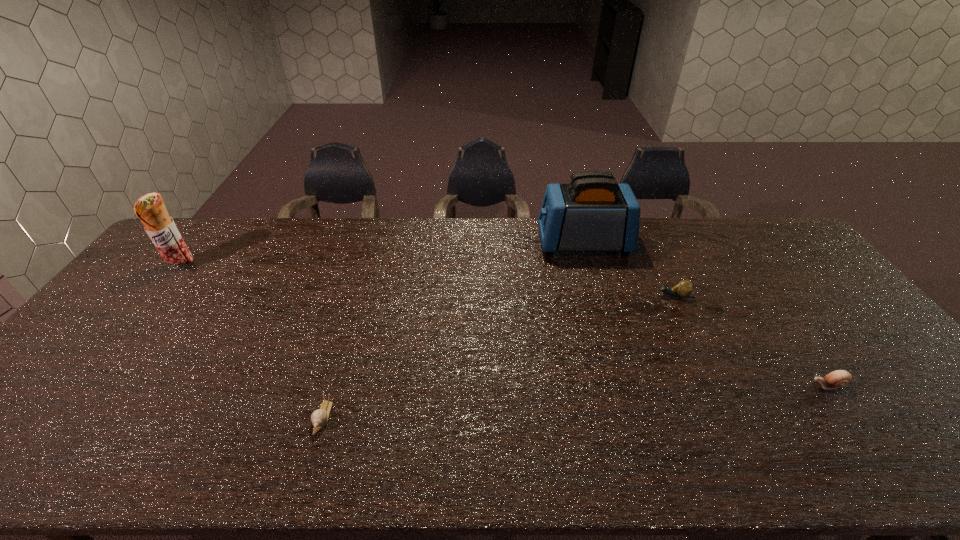
The width and height of the screenshot is (960, 540). What are the coordinates of `the third object from right to left` in the screenshot? It's located at (593, 213).

This screenshot has height=540, width=960. I want to click on the leftmost object, so click(x=150, y=209).

Identify the location of the farthest escargot. The width and height of the screenshot is (960, 540). (684, 288).

Identify the location of the fourth object from left to right. (684, 288).

You are a GUI agent. You are given a task and a screenshot of the screen. Output one action in this format:
    pyautogui.click(x=<x>, y=<y>)
    Task: Click on the fourth farthest object
    This screenshot has height=540, width=960.
    Given the screenshot: What is the action you would take?
    pyautogui.click(x=839, y=378)

You are a GUI agent. You are given a task and a screenshot of the screen. Output one action in this format:
    pyautogui.click(x=<x>, y=<y>)
    Task: Click on the rightmost object
    
    Given the screenshot: What is the action you would take?
    pyautogui.click(x=839, y=378)

I want to click on the shortest escargot, so click(x=319, y=418).

What are the coordinates of `the leftmost escargot` in the screenshot? It's located at (319, 418).

Locate an element on the screen. vacant space located on the front-facing side of the toaster is located at coordinates (461, 243).

Where is `blank space located on the front-facing side of the toaster`? The image size is (960, 540). blank space located on the front-facing side of the toaster is located at coordinates (504, 243).